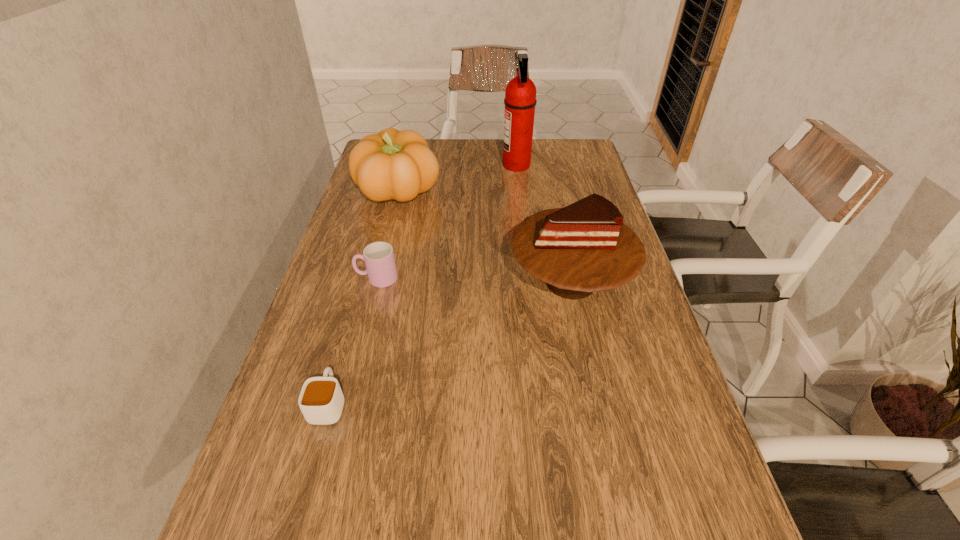
Find the location of a particular element. The height and width of the screenshot is (540, 960). unoccupied area between the taller cup and the pumpkin is located at coordinates click(388, 235).

Find the location of `free area in between the tallest object and the taller cup`. free area in between the tallest object and the taller cup is located at coordinates (446, 222).

What are the coordinates of `free spot between the taller cup and the shorter cup` in the screenshot? It's located at (352, 341).

Choose which object is the second nearest neighbor to the pumpkin. Please provide its 2D coordinates. Your answer should be formatted as a tuple, i.e. [(x, y)], where the tuple contains the x and y coordinates of a point satisfying the conditions above.

[(582, 248)]

Identify which object is the fourth nearest to the nearer cup. Please provide its 2D coordinates. Your answer should be formatted as a tuple, i.e. [(x, y)], where the tuple contains the x and y coordinates of a point satisfying the conditions above.

[(520, 100)]

I want to click on vacant point that satisfies the following two spatial constraints: 1. on the side of the tallest object near the handle; 2. on the front side of the pumpkin, so click(x=519, y=192).

You are a GUI agent. You are given a task and a screenshot of the screen. Output one action in this format:
    pyautogui.click(x=<x>, y=<y>)
    Task: Click on the free region that satisfies the following two spatial constraints: 1. on the back side of the cake; 2. on the side of the tallest object near the handle
    Image resolution: width=960 pixels, height=540 pixels.
    Given the screenshot: What is the action you would take?
    pyautogui.click(x=545, y=165)

Locate an element on the screen. The width and height of the screenshot is (960, 540). vacant space that satisfies the following two spatial constraints: 1. with the handle on the side of the pumpkin; 2. on the right side of the second shortest object is located at coordinates (398, 192).

Identify the location of free space that satisfies the following two spatial constraints: 1. with the handle on the side of the second shortest object; 2. on the back side of the pumpkin. (398, 192).

Image resolution: width=960 pixels, height=540 pixels. Find the location of `vacant point that satisfies the following two spatial constraints: 1. on the side with the handle of the cake; 2. on the left side of the shorter cup`. vacant point that satisfies the following two spatial constraints: 1. on the side with the handle of the cake; 2. on the left side of the shorter cup is located at coordinates (363, 281).